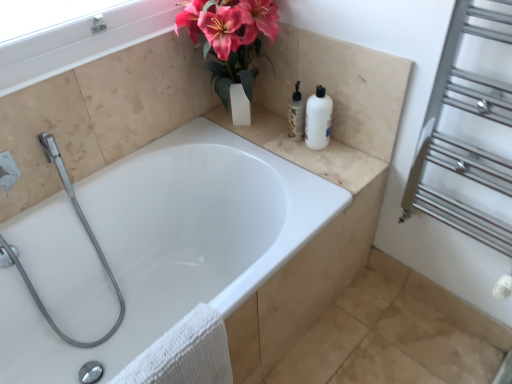
Question: Does white glossy bathtub at center have a smaller size compared to white glossy bottle at upper center?

Choices:
 (A) no
 (B) yes

Answer: (A)

Question: Considering the relative sizes of white glossy bathtub at center and white glossy bottle at upper center in the image provided, is white glossy bathtub at center shorter than white glossy bottle at upper center?

Choices:
 (A) yes
 (B) no

Answer: (B)

Question: Does white glossy bathtub at center turn towards white glossy bottle at upper center?

Choices:
 (A) yes
 (B) no

Answer: (B)

Question: Is white glossy bathtub at center at the left side of white glossy bottle at upper center?

Choices:
 (A) no
 (B) yes

Answer: (B)

Question: Does white glossy bathtub at center have a lesser width compared to white glossy bottle at upper center?

Choices:
 (A) yes
 (B) no

Answer: (B)

Question: Can you confirm if white glossy bathtub at center is wider than white glossy bottle at upper center?

Choices:
 (A) no
 (B) yes

Answer: (B)

Question: From a real-world perspective, is white glossy bottle at upper center positioned over beige marble counter top at upper right based on gravity?

Choices:
 (A) yes
 (B) no

Answer: (A)

Question: Does white glossy bottle at upper center have a larger size compared to beige marble counter top at upper right?

Choices:
 (A) yes
 (B) no

Answer: (B)

Question: Can you confirm if white glossy bottle at upper center is positioned to the right of beige marble counter top at upper right?

Choices:
 (A) yes
 (B) no

Answer: (A)

Question: Can you confirm if white glossy bottle at upper center is wider than beige marble counter top at upper right?

Choices:
 (A) no
 (B) yes

Answer: (A)

Question: Is white glossy bottle at upper center outside of beige marble counter top at upper right?

Choices:
 (A) no
 (B) yes

Answer: (B)

Question: Would you consider white glossy bottle at upper center to be distant from beige marble counter top at upper right?

Choices:
 (A) yes
 (B) no

Answer: (B)

Question: Does silver metallic towel rack at right have a lesser height compared to beige marble counter top at upper right?

Choices:
 (A) yes
 (B) no

Answer: (B)